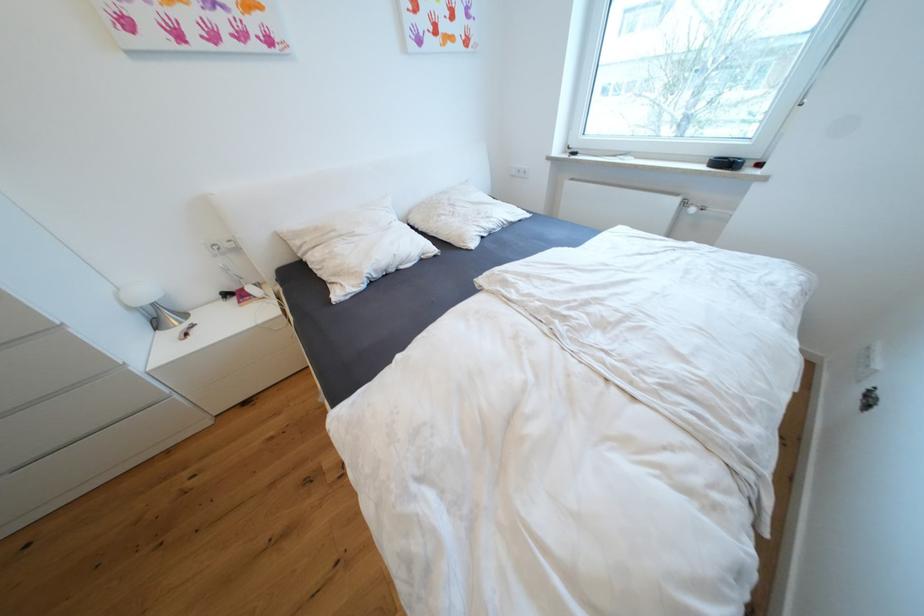
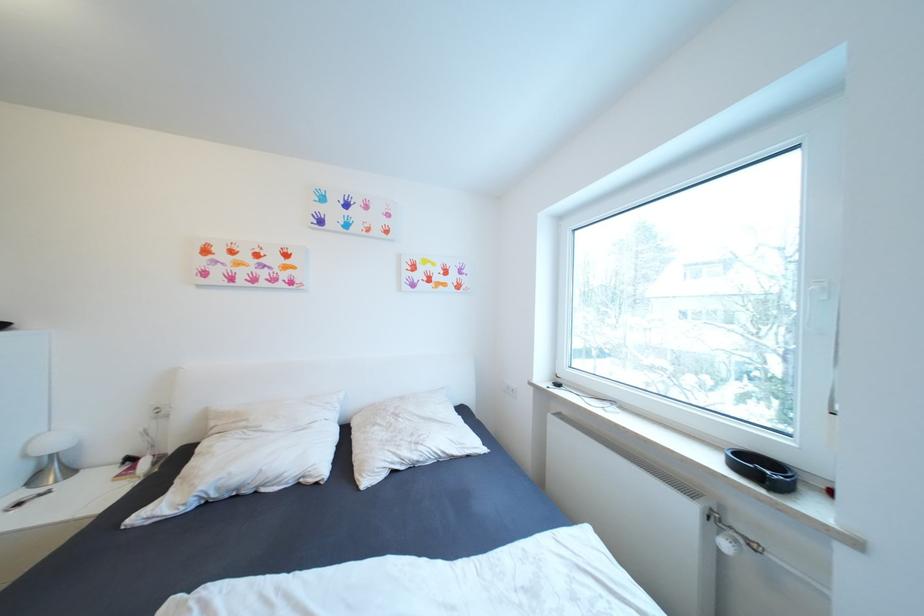
The point at (305, 244) is marked in the first image. Where is the corresponding point in the second image?

(220, 424)